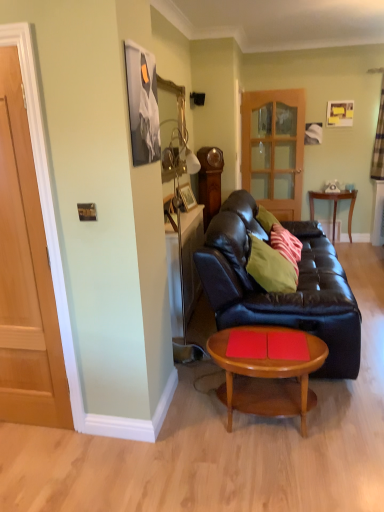
Question: Does green matte pillow at center, the 1th pillow from the front, come behind white sheer curtain at upper right?

Choices:
 (A) yes
 (B) no

Answer: (B)

Question: From the image's perspective, is green matte pillow at center, the 1th pillow from the front, over white sheer curtain at upper right?

Choices:
 (A) no
 (B) yes

Answer: (A)

Question: From a real-world perspective, is green matte pillow at center, the second pillow positioned from the back, below white sheer curtain at upper right?

Choices:
 (A) yes
 (B) no

Answer: (A)

Question: Can you confirm if green matte pillow at center, the second pillow positioned from the back, is smaller than white sheer curtain at upper right?

Choices:
 (A) no
 (B) yes

Answer: (A)

Question: Is green matte pillow at center, the second pillow positioned from the back, facing towards white sheer curtain at upper right?

Choices:
 (A) yes
 (B) no

Answer: (B)

Question: Considering the relative positions of green matte pillow at center, the 1th pillow from the front, and white sheer curtain at upper right in the image provided, is green matte pillow at center, the 1th pillow from the front, to the right of white sheer curtain at upper right from the viewer's perspective?

Choices:
 (A) yes
 (B) no

Answer: (B)

Question: From the image's perspective, is wooden door at left located beneath light brown wooden coffee table at center?

Choices:
 (A) yes
 (B) no

Answer: (B)

Question: Is wooden door at left in contact with light brown wooden coffee table at center?

Choices:
 (A) yes
 (B) no

Answer: (B)

Question: Is wooden door at left completely or partially outside of light brown wooden coffee table at center?

Choices:
 (A) yes
 (B) no

Answer: (A)

Question: Would you say wooden door at left contains light brown wooden coffee table at center?

Choices:
 (A) no
 (B) yes

Answer: (A)

Question: Considering the relative sizes of wooden door at left and light brown wooden coffee table at center in the image provided, is wooden door at left wider than light brown wooden coffee table at center?

Choices:
 (A) no
 (B) yes

Answer: (A)

Question: From a real-world perspective, is wooden door at left positioned over light brown wooden coffee table at center based on gravity?

Choices:
 (A) no
 (B) yes

Answer: (B)

Question: Can you confirm if wooden side table at right is positioned to the left of translucent wooden door at center?

Choices:
 (A) yes
 (B) no

Answer: (B)